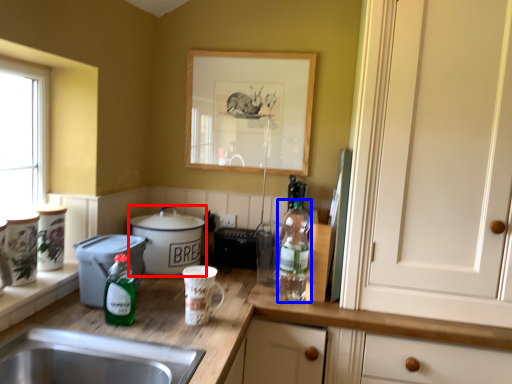
Question: Which of the following is the closest to the observer, cooker (highlighted by a red box) or bottle (highlighted by a blue box)?

Choices:
 (A) cooker
 (B) bottle

Answer: (B)